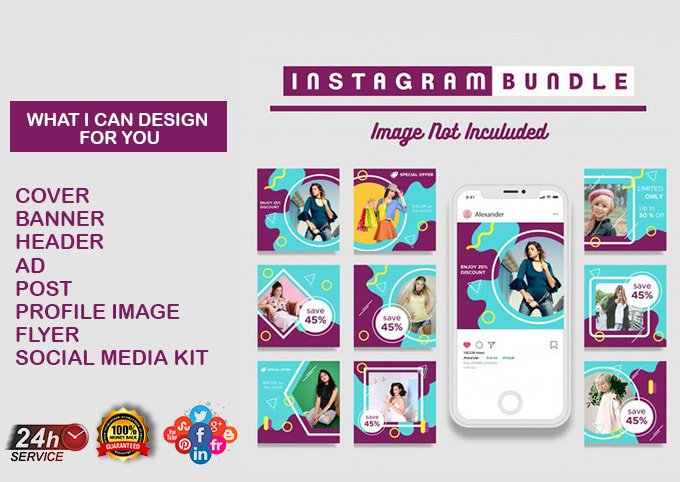
Find the location of a particular element. small square tiles is located at coordinates (318, 221), (300, 320), (411, 403), (394, 319), (401, 212), (313, 412), (622, 208), (619, 306), (629, 401).